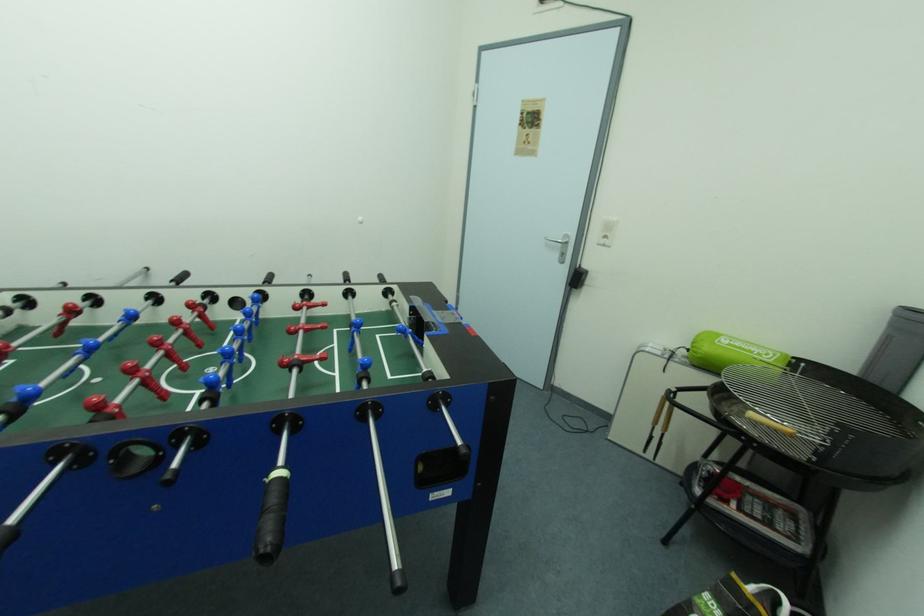
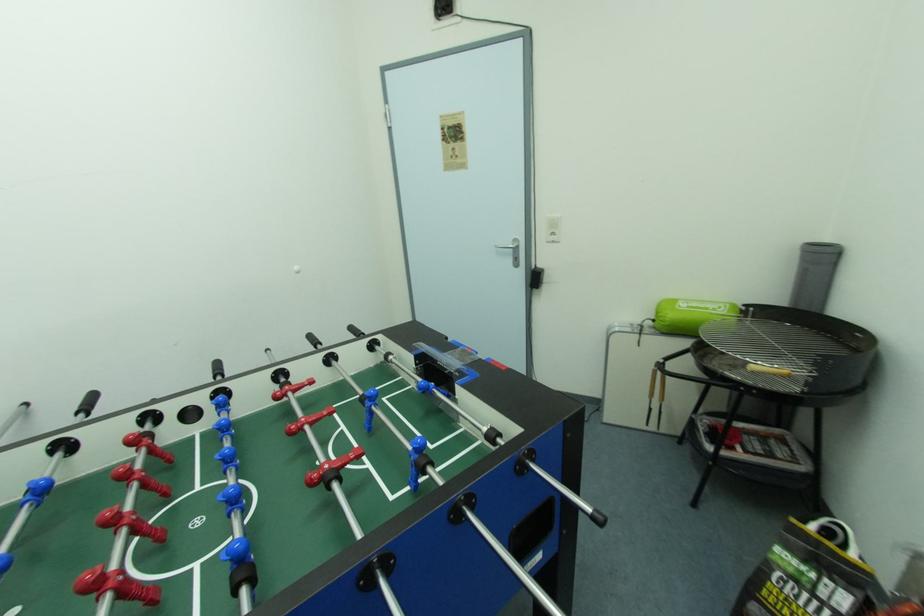
Question: The camera is either moving clockwise (left) or counter-clockwise (right) around the object. The first image is from the beginning of the video and the second image is from the end. Is the camera moving left or right when shooting the video?

Choices:
 (A) Left
 (B) Right

Answer: (A)